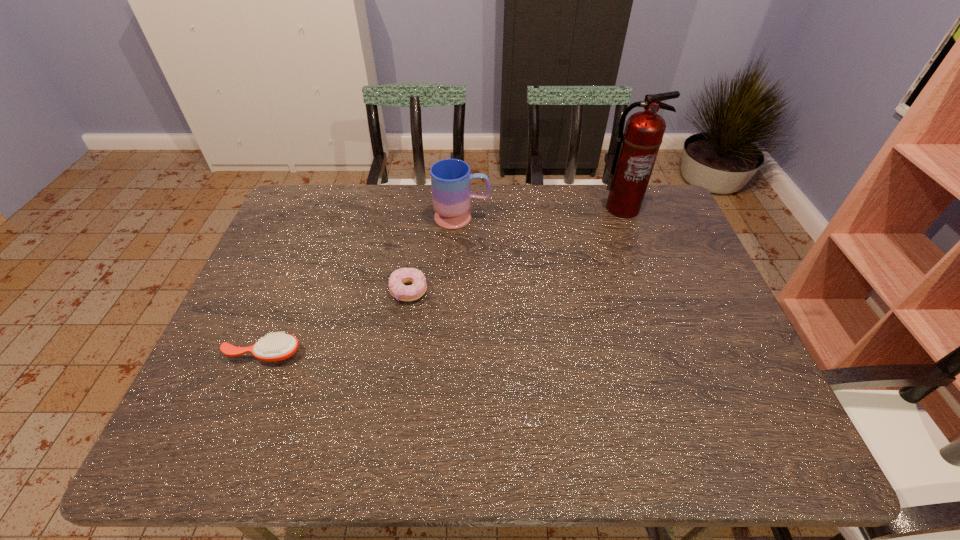
Image resolution: width=960 pixels, height=540 pixels. What are the coordinates of `fire extinguisher present at the far edge` in the screenshot? It's located at (637, 148).

Identify the location of mug located in the far edge section of the desktop. Image resolution: width=960 pixels, height=540 pixels. (451, 179).

Where is `object located at the left edge`? object located at the left edge is located at coordinates (278, 346).

Locate an element on the screen. The image size is (960, 540). object that is at the right edge is located at coordinates (637, 148).

The width and height of the screenshot is (960, 540). Find the location of `object located in the far right corner section of the desktop`. object located in the far right corner section of the desktop is located at coordinates (637, 148).

Locate an element on the screen. The width and height of the screenshot is (960, 540). free space at the far edge of the desktop is located at coordinates (415, 208).

Find the location of a particular element. free space at the near edge is located at coordinates (574, 426).

The height and width of the screenshot is (540, 960). In the image, there is a desktop. What are the coordinates of `vacant space at the left edge` in the screenshot? It's located at (249, 356).

Locate an element on the screen. The width and height of the screenshot is (960, 540). vacant space at the right edge of the desktop is located at coordinates (700, 296).

Locate an element on the screen. The image size is (960, 540). free space at the far left corner of the desktop is located at coordinates tap(297, 191).